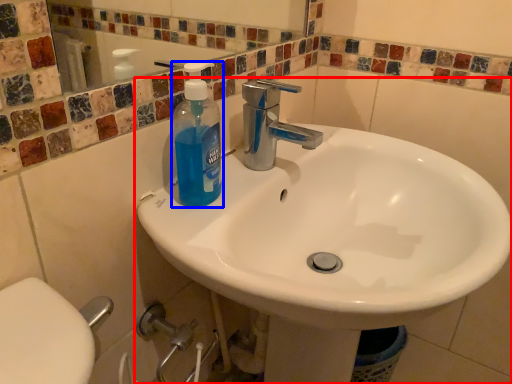
Question: Which point is further to the camera, sink (highlighted by a red box) or cleaning product (highlighted by a blue box)?

Choices:
 (A) sink
 (B) cleaning product

Answer: (B)